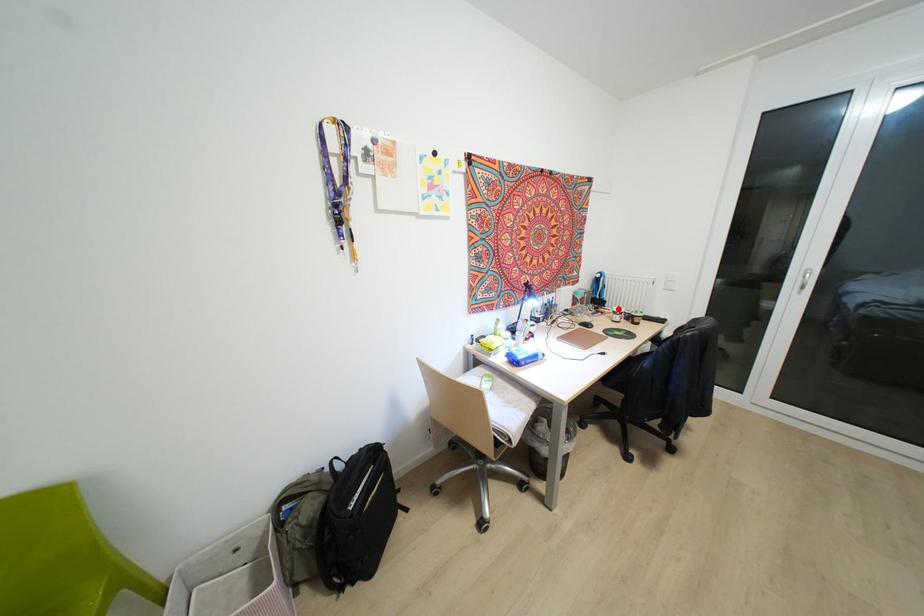
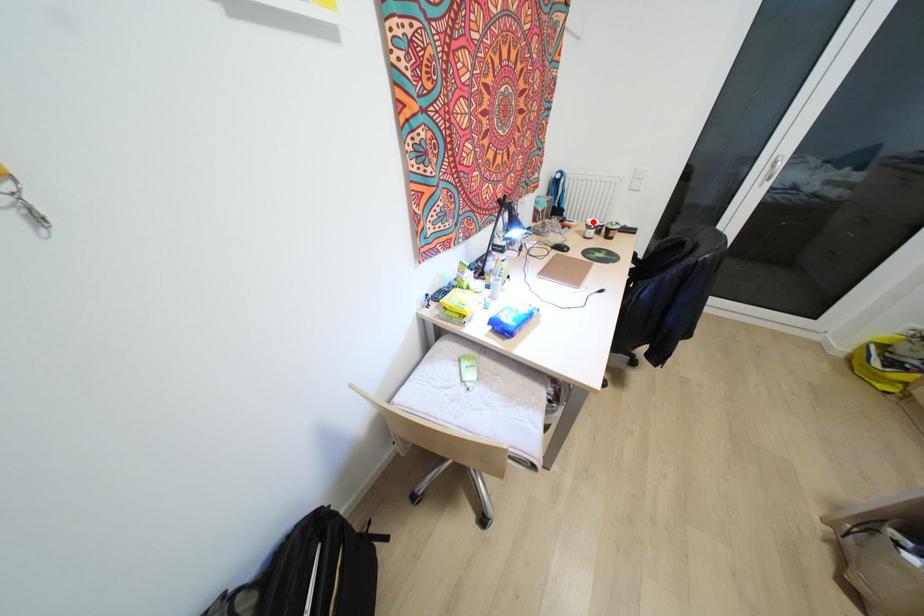
I am providing you with two images of the same scene from different viewpoints. A red point is marked on the first image and another point is marked on the second image. Do the highlighted points in image1 and image2 indicate the same real-world spot?

Yes